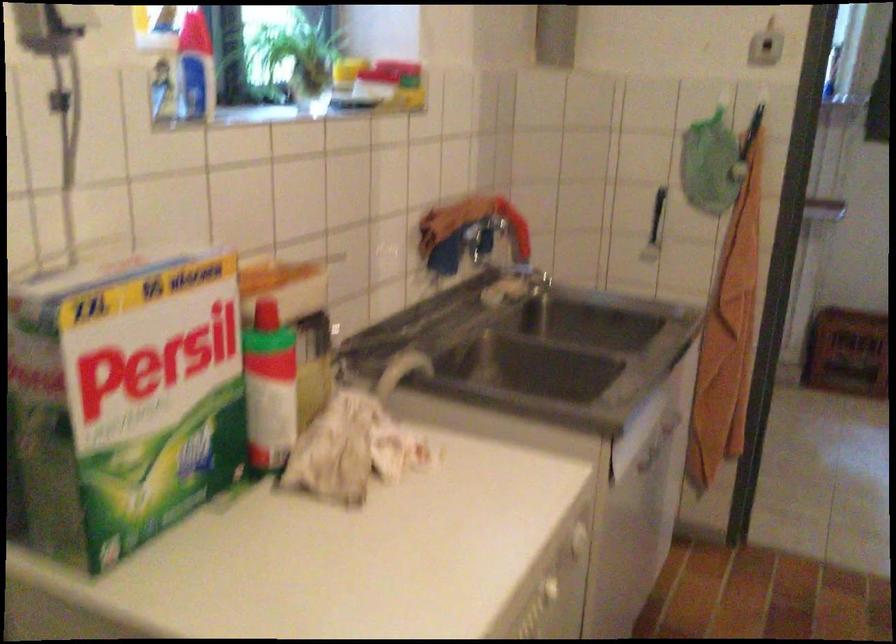
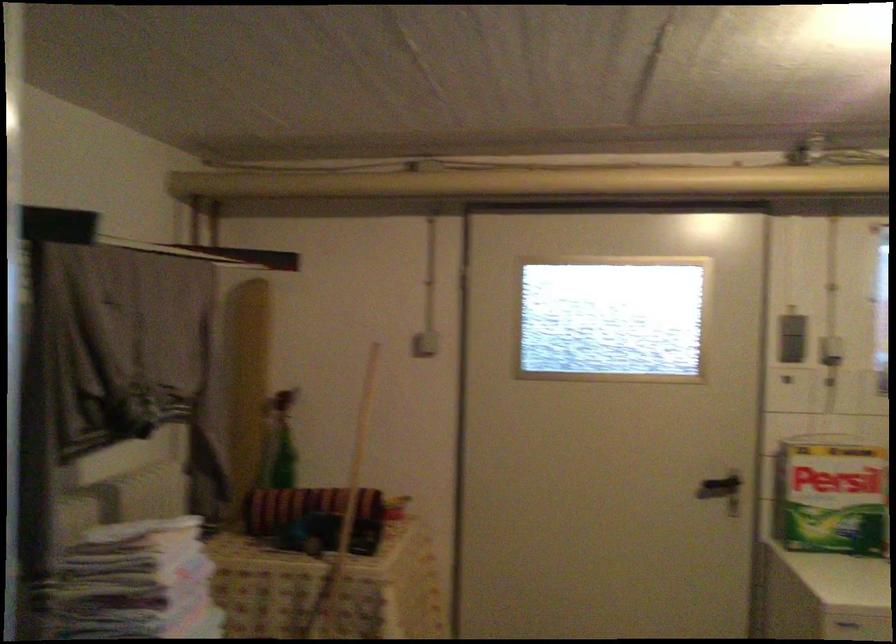
In the second image, find the point that corresponds to [145,410] in the first image.

(831, 496)